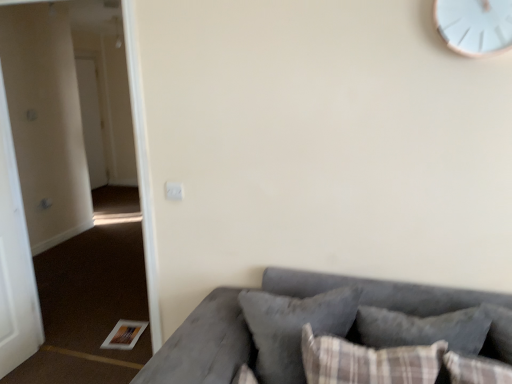
Question: Is white plastic clock at upper right next to white glossy door at left, placed as the first door when sorted from back to front?

Choices:
 (A) no
 (B) yes

Answer: (A)

Question: From a real-world perspective, is white plastic clock at upper right below white glossy door at left, the second door positioned from the front?

Choices:
 (A) no
 (B) yes

Answer: (A)

Question: From the image's perspective, is white plastic clock at upper right under white glossy door at left, positioned as the second door in right-to-left order?

Choices:
 (A) no
 (B) yes

Answer: (B)

Question: From the image's perspective, would you say white plastic clock at upper right is positioned over white glossy door at left, placed as the first door when sorted from back to front?

Choices:
 (A) yes
 (B) no

Answer: (B)

Question: Is white plastic clock at upper right oriented away from white glossy door at left, positioned as the second door in right-to-left order?

Choices:
 (A) yes
 (B) no

Answer: (B)

Question: Would you say white plastic clock at upper right contains white glossy door at left, positioned as the second door in right-to-left order?

Choices:
 (A) yes
 (B) no

Answer: (B)

Question: Can you confirm if brown carpet at lower left is thinner than velvet gray couch at lower right?

Choices:
 (A) yes
 (B) no

Answer: (A)

Question: Considering the relative sizes of brown carpet at lower left and velvet gray couch at lower right in the image provided, is brown carpet at lower left shorter than velvet gray couch at lower right?

Choices:
 (A) yes
 (B) no

Answer: (B)

Question: Are brown carpet at lower left and velvet gray couch at lower right making contact?

Choices:
 (A) yes
 (B) no

Answer: (B)

Question: Is brown carpet at lower left completely or partially outside of velvet gray couch at lower right?

Choices:
 (A) yes
 (B) no

Answer: (A)

Question: Is brown carpet at lower left bigger than velvet gray couch at lower right?

Choices:
 (A) no
 (B) yes

Answer: (A)

Question: Is the depth of brown carpet at lower left greater than that of velvet gray couch at lower right?

Choices:
 (A) no
 (B) yes

Answer: (B)

Question: Is white matte door at left, placed as the second door when sorted from back to front, far away from brown carpet at lower left?

Choices:
 (A) no
 (B) yes

Answer: (A)